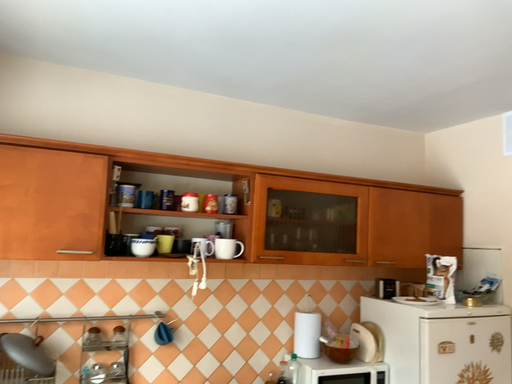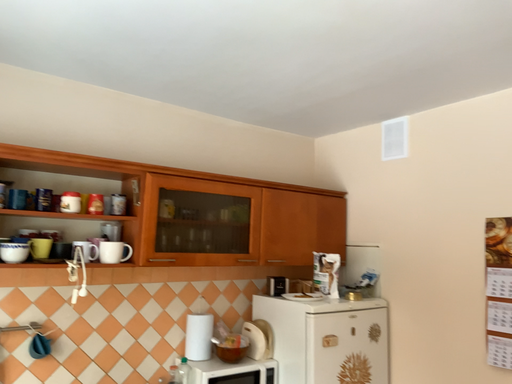
Question: Which way did the camera rotate in the video?

Choices:
 (A) rotated right
 (B) rotated left

Answer: (A)